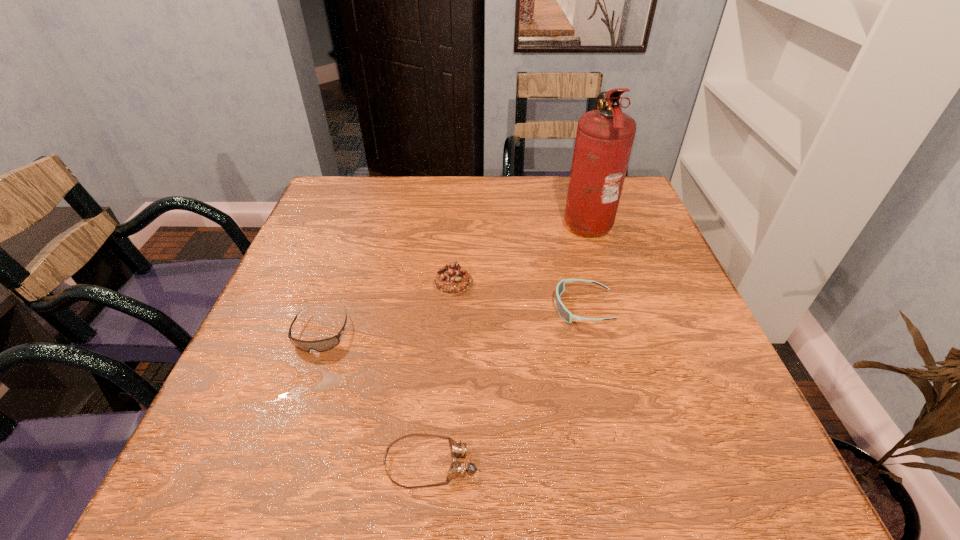
Locate an element on the screen. object positioned at the far right corner is located at coordinates (604, 139).

Find the location of `free space at the far edge`. free space at the far edge is located at coordinates (431, 202).

Locate an element on the screen. The image size is (960, 540). free space at the near edge of the desktop is located at coordinates (553, 481).

Locate an element on the screen. Image resolution: width=960 pixels, height=540 pixels. vacant region at the left edge of the desktop is located at coordinates (313, 226).

The height and width of the screenshot is (540, 960). In the image, there is a desktop. Identify the location of vacant space at the right edge. (615, 246).

In the image, there is a desktop. Where is `vacant space at the far left corner`? Image resolution: width=960 pixels, height=540 pixels. vacant space at the far left corner is located at coordinates (358, 179).

I want to click on free space between the leftmost object and the chocolate cake, so point(387,308).

You are a GUI agent. You are given a task and a screenshot of the screen. Output one action in this format:
    pyautogui.click(x=<x>, y=<y>)
    Task: Click on the vacant space that is in between the farthest object and the rightmost goggles
    Image resolution: width=960 pixels, height=540 pixels.
    Given the screenshot: What is the action you would take?
    pyautogui.click(x=585, y=265)

You are a GUI agent. You are given a task and a screenshot of the screen. Output one action in this format:
    pyautogui.click(x=<x>, y=<y>)
    Task: Click on the free space between the fire extinguisher and the nearest goggles
    
    Given the screenshot: What is the action you would take?
    pyautogui.click(x=509, y=342)

Identify the location of free spot between the chocolate cake and the farthest object. Image resolution: width=960 pixels, height=540 pixels. (519, 252).